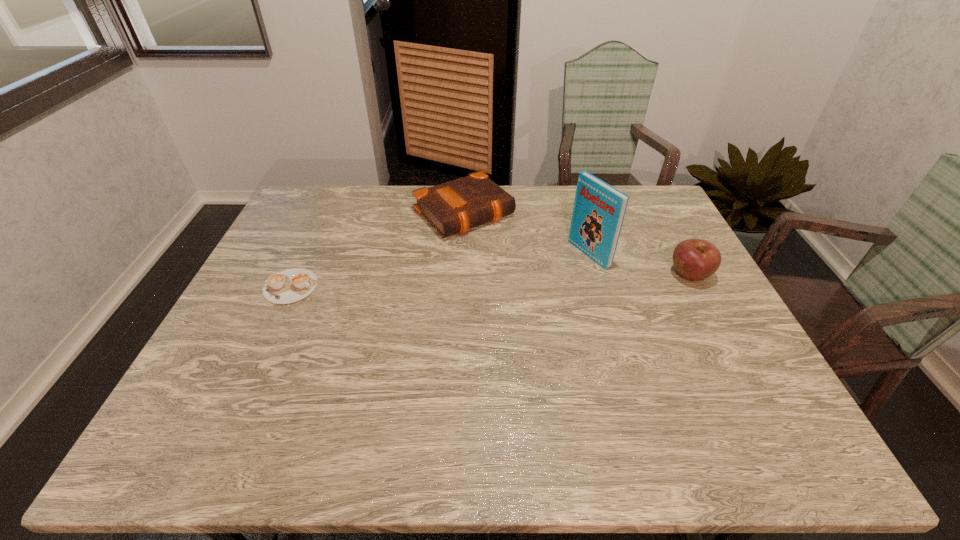
Find the location of `cappuccino`. cappuccino is located at coordinates (x=289, y=286).

Identify the location of the leftmost object. This screenshot has height=540, width=960. (289, 286).

Where is `apple`? The image size is (960, 540). apple is located at coordinates (694, 259).

At what (x,y) coordinates should I click in order to perform the action: click on the second tallest object. Please return your answer as a coordinate pair (x, y). This screenshot has height=540, width=960. Looking at the image, I should click on (694, 259).

Where is `the tallest object`? the tallest object is located at coordinates (599, 209).

Find the location of a particular element. the third object from left to right is located at coordinates (599, 209).

Find the location of a particular element. the second object from left to right is located at coordinates (453, 207).

Find the location of `Bible`. Bible is located at coordinates (453, 207).

This screenshot has width=960, height=540. Find the location of `vacant area situated on the right of the leftmost object`. vacant area situated on the right of the leftmost object is located at coordinates (386, 287).

The height and width of the screenshot is (540, 960). In order to click on free space located on the side of the second tallest object with the unique marking in this screenshot , I will do `click(602, 275)`.